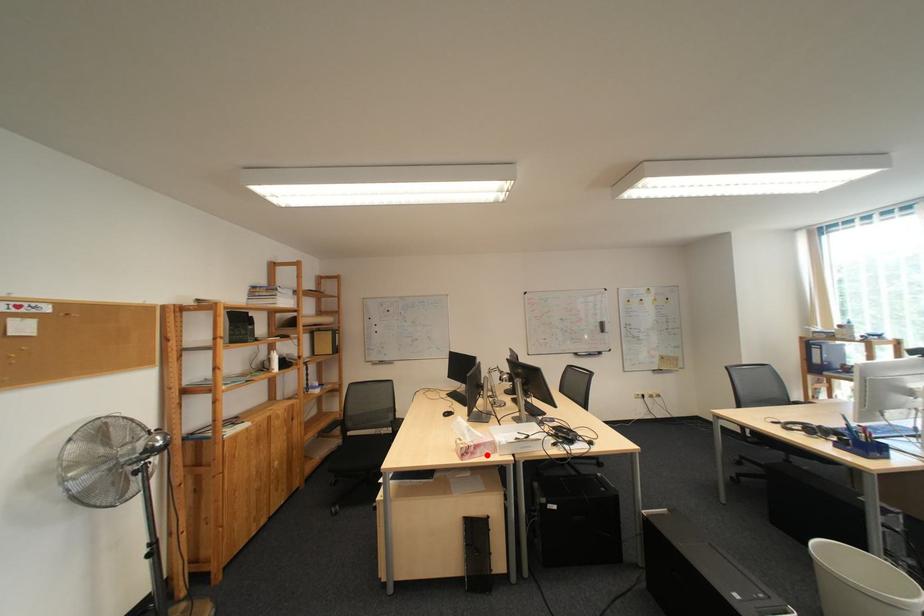
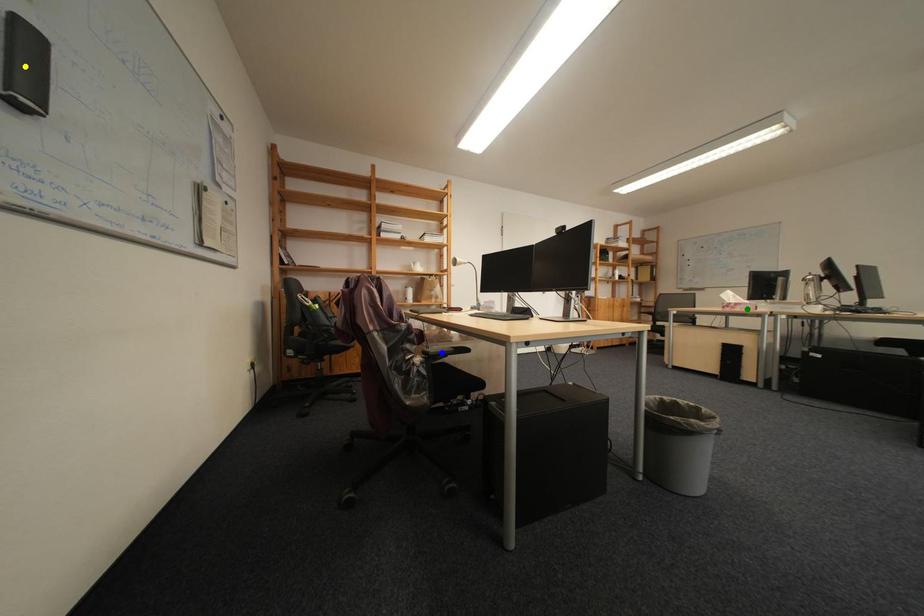
Question: I am providing you with two images of the same scene from different viewpoints. A red point is marked on the first image. You are given multiple points on the second image. Can you choose the point in image 2 that corresponds to the point in image 1?

Choices:
 (A) blue point
 (B) green point
 (C) yellow point

Answer: (B)